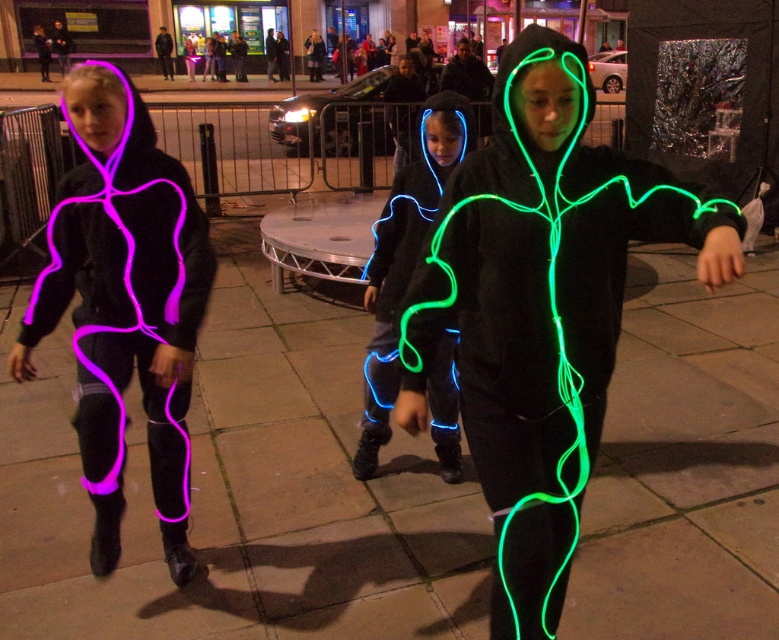
Does green neon lines at center appear under matte black hoodie at left?

Yes, green neon lines at center is below matte black hoodie at left.

Between green neon lines at center and matte black hoodie at left, which one appears on the left side from the viewer's perspective?

Positioned to the left is matte black hoodie at left.

Does point (520, 74) come closer to viewer compared to point (147, 152)?

Yes, point (520, 74) is closer to viewer.

I want to click on green neon lines at center, so click(x=541, y=307).

Can you confirm if slate stone pavement at center is positioned above neon blue fabric at center?

Actually, slate stone pavement at center is below neon blue fabric at center.

Consider the image. Does slate stone pavement at center lie in front of neon blue fabric at center?

Yes, slate stone pavement at center is in front of neon blue fabric at center.

You are a GUI agent. You are given a task and a screenshot of the screen. Output one action in this format:
    pyautogui.click(x=<x>, y=<y>)
    Task: Click on the slate stone pavement at center
    This screenshot has width=779, height=640.
    Given the screenshot: What is the action you would take?
    (242, 490)

Measure the distance from slate stone pavement at center to green neon lines at center.

slate stone pavement at center and green neon lines at center are 1.43 meters apart from each other.

Is slate stone pavement at center further to camera compared to green neon lines at center?

Yes.

Is point (67, 500) closer to camera compared to point (637, 227)?

No, it is behind (637, 227).

The height and width of the screenshot is (640, 779). I want to click on slate stone pavement at center, so click(242, 490).